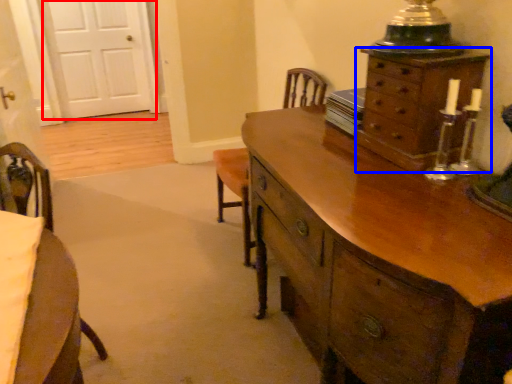
Question: Which object appears closest to the camera in this image, door (highlighted by a red box) or chest of drawers (highlighted by a blue box)?

Choices:
 (A) door
 (B) chest of drawers

Answer: (B)